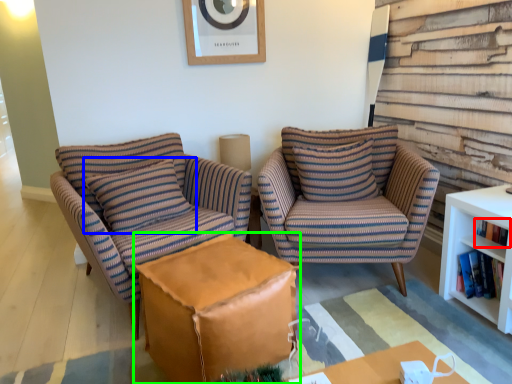
Question: Estimate the real-world distances between objects in this image. Which object is farther from book (highlighted by a red box), pillow (highlighted by a blue box) or table (highlighted by a green box)?

Choices:
 (A) pillow
 (B) table

Answer: (A)